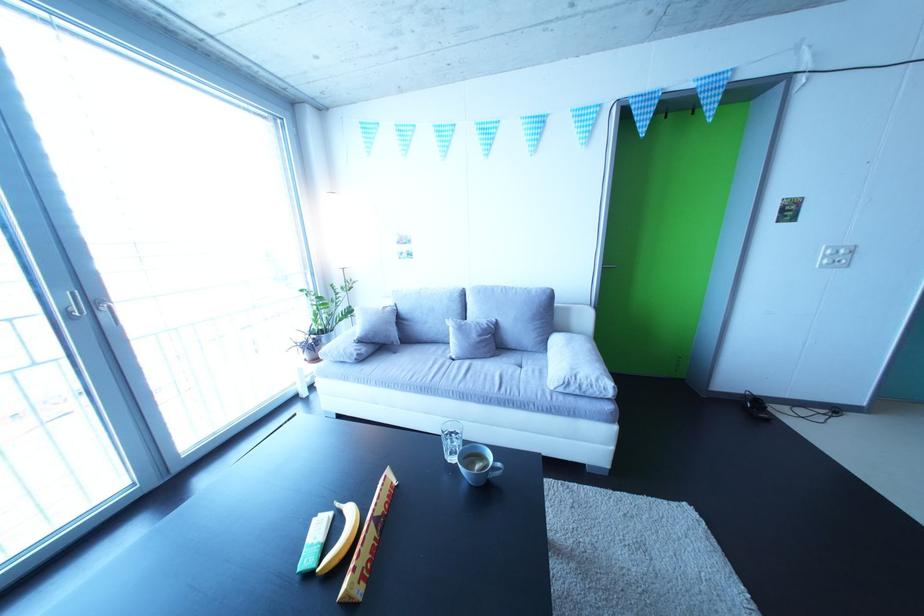
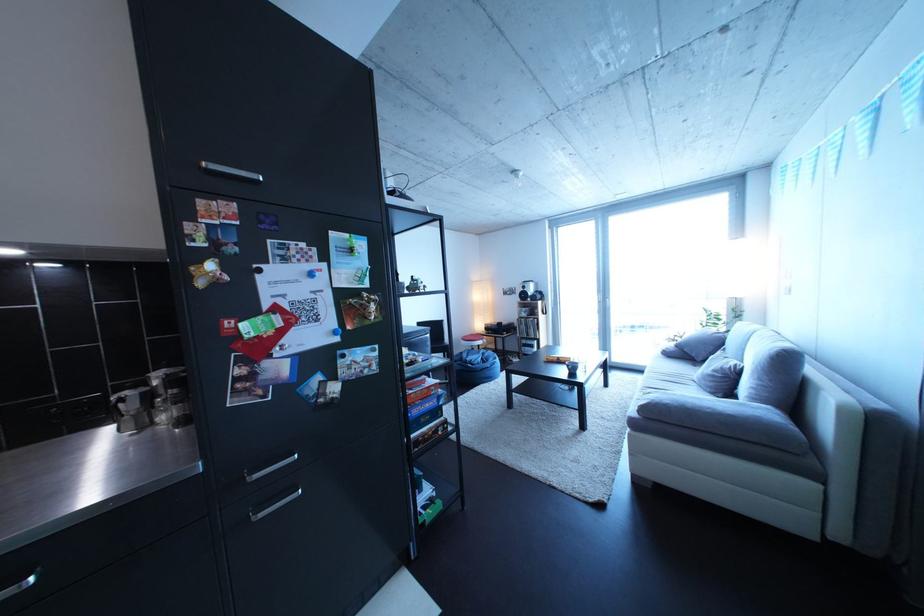
Locate, in the second image, the point that corresponds to [492,342] in the first image.

(727, 377)